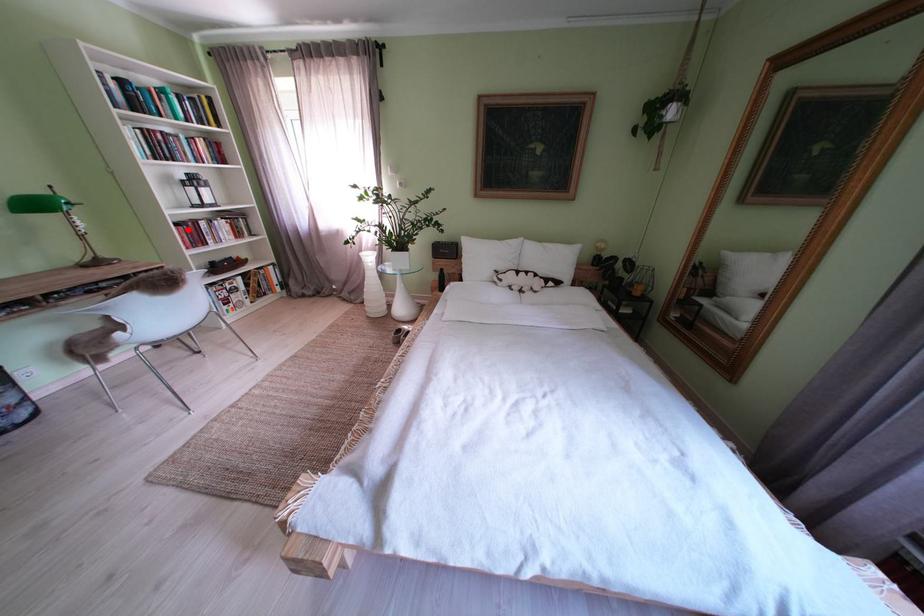
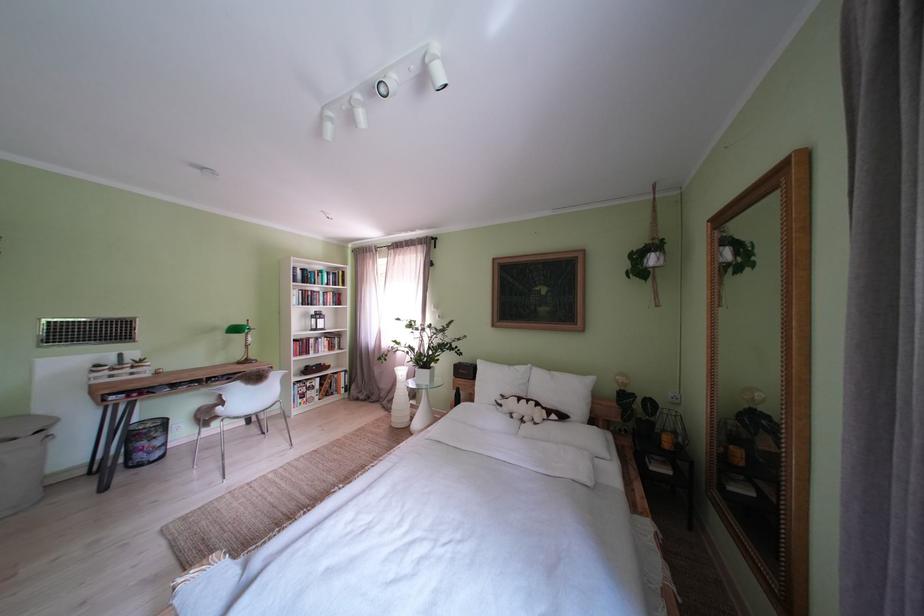
Question: I am providing you with two images of the same scene from different viewpoints. A red point is marked on the first image. At the location where the point appears in image 1, is it still visible in image 2?

Choices:
 (A) Yes
 (B) No

Answer: (A)